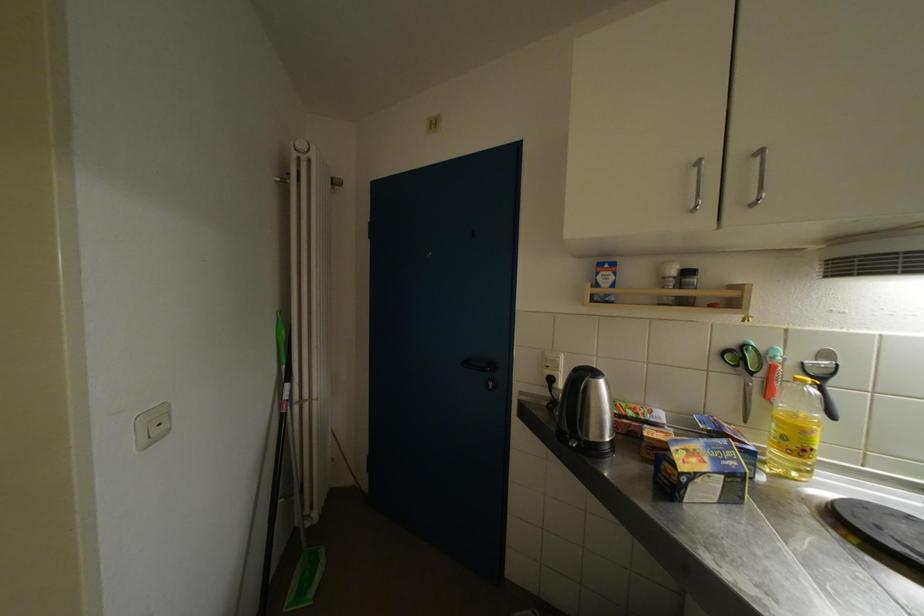
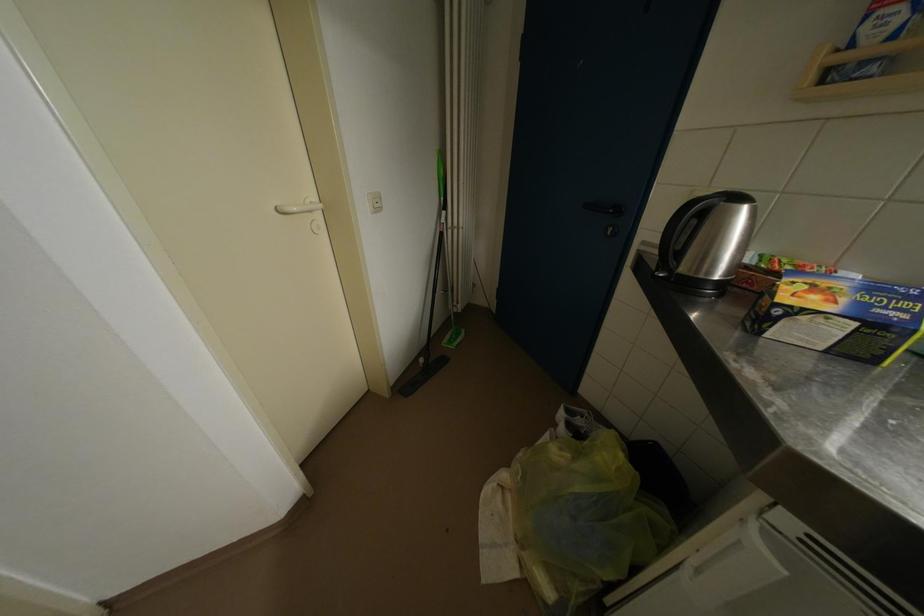
Locate, in the second image, the point that corresponds to point 296,382 in the first image.

(451, 211)